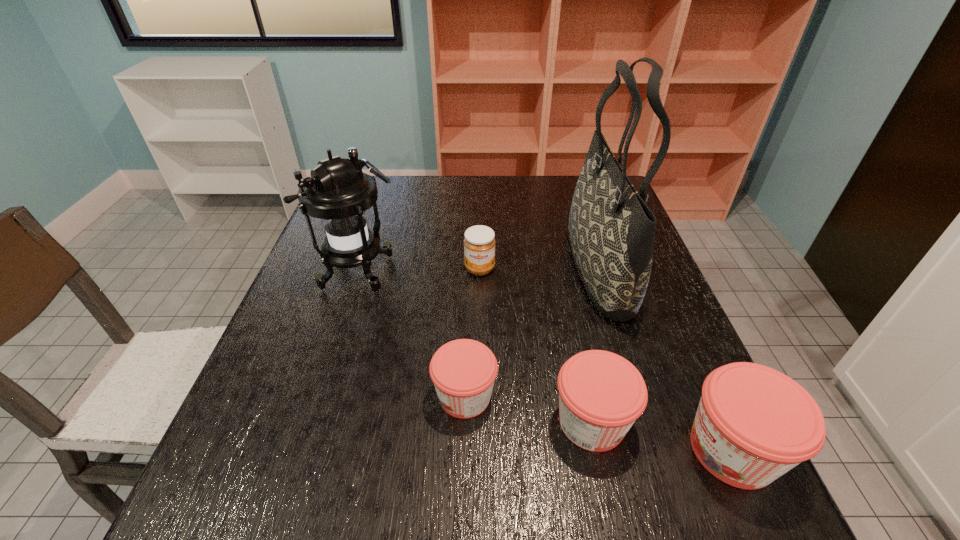
The height and width of the screenshot is (540, 960). What are the coordinates of `vacant space situated 0.260m on the front label of the farthest jam` in the screenshot? It's located at (480, 361).

The image size is (960, 540). In order to click on vacant space located on the left of the tallest object in this screenshot , I will do `click(492, 267)`.

Identify the location of vacant area situated 0.360m on the right of the fifth shortest object. (540, 271).

This screenshot has height=540, width=960. I want to click on object that is at the left edge, so [338, 192].

Locate an element on the screen. This screenshot has width=960, height=540. jam that is at the right edge is located at coordinates (753, 424).

Find the location of `tote bag present at the right edge`. tote bag present at the right edge is located at coordinates (611, 230).

I want to click on object that is at the near right corner, so click(x=753, y=424).

You are a GUI agent. You are given a task and a screenshot of the screen. Output one action in this format:
    pyautogui.click(x=<x>, y=<y>)
    Task: Click on the blank space at the far edge of the desktop
    
    Given the screenshot: What is the action you would take?
    pyautogui.click(x=460, y=185)

Where is `free location at the near edge`? The height and width of the screenshot is (540, 960). free location at the near edge is located at coordinates (543, 425).

Where is `free space at the left edge of the desktop`? free space at the left edge of the desktop is located at coordinates (350, 294).